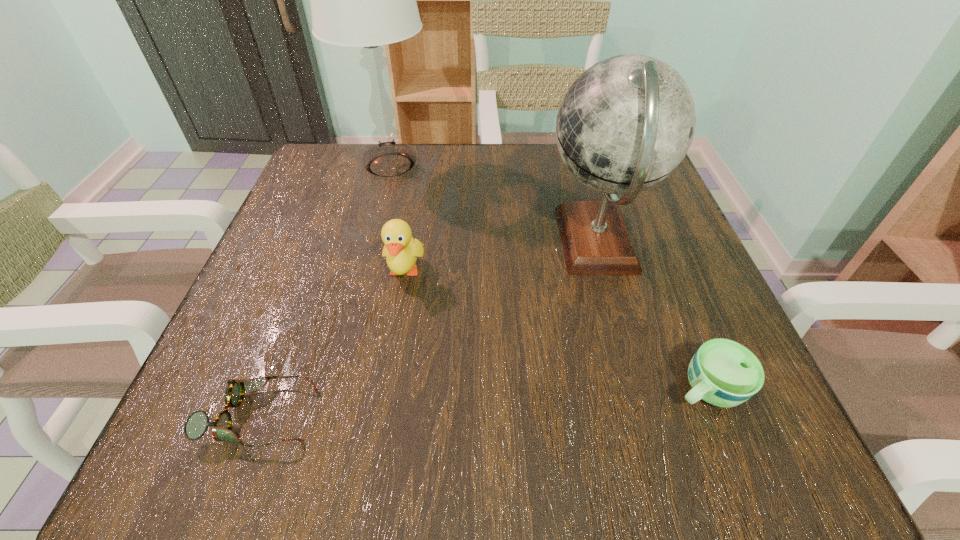
I want to click on the farthest object, so click(x=365, y=0).

Where is `the tallest object`? the tallest object is located at coordinates (365, 0).

Where is `the second tallest object`? The width and height of the screenshot is (960, 540). the second tallest object is located at coordinates (626, 123).

What are the coordinates of `the third tallest object` in the screenshot? It's located at (401, 250).

Locate an element on the screen. The image size is (960, 540). the fourth tallest object is located at coordinates (724, 373).

Locate an element on the screen. Image resolution: width=960 pixels, height=540 pixels. spectacles is located at coordinates (197, 423).

Where is `vacant region located 0.340m on the front-facing side of the tallest object`? The width and height of the screenshot is (960, 540). vacant region located 0.340m on the front-facing side of the tallest object is located at coordinates (580, 165).

You are a GUI agent. You are given a task and a screenshot of the screen. Output one action in this format:
    pyautogui.click(x=<x>, y=<y>)
    Task: Click on the free space located 0.130m at the equator of the globe
    The width and height of the screenshot is (960, 540).
    Given the screenshot: What is the action you would take?
    coord(474,242)

Where is `vacant region located at the equator of the globe`? This screenshot has width=960, height=540. vacant region located at the equator of the globe is located at coordinates (479, 242).

Identify the location of free space located at the equator of the globe. The width and height of the screenshot is (960, 540). (417, 242).